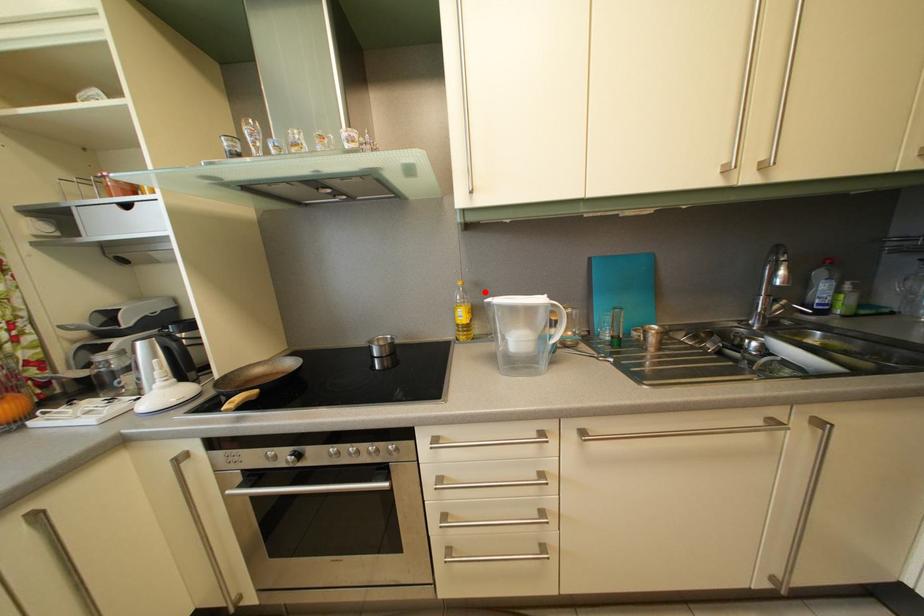
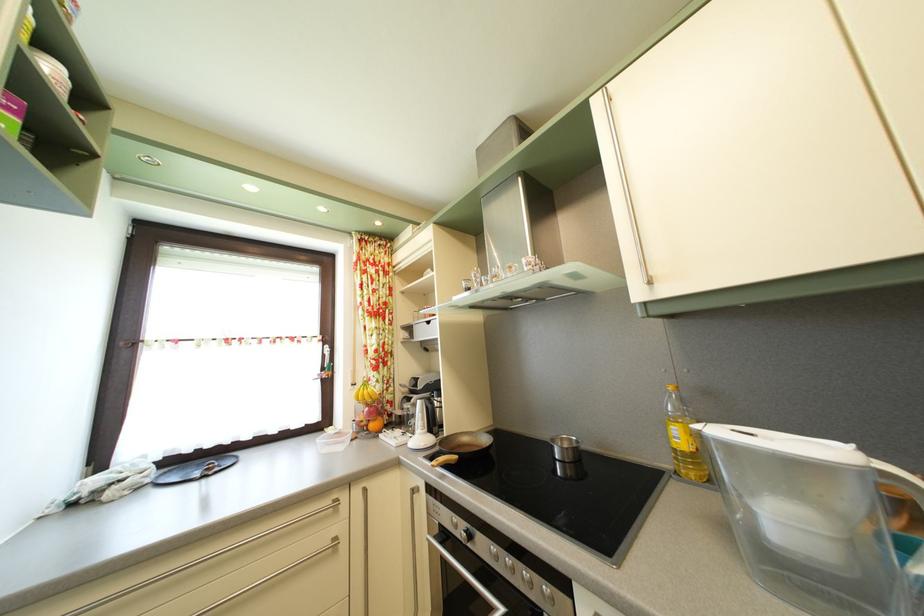
Locate, in the second image, the point that corresponds to the highlighted location in the first image.

(715, 400)